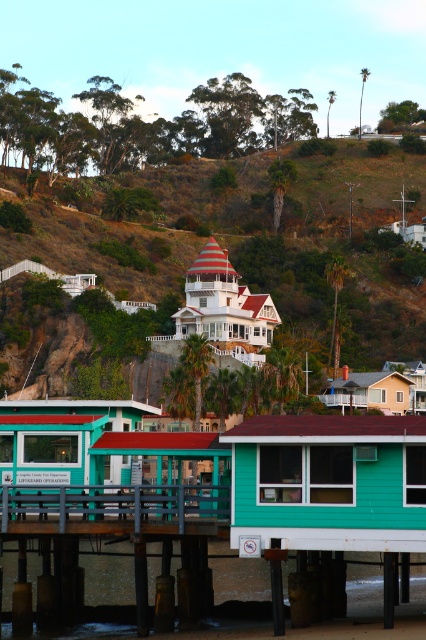
You are a tourist visiting the coastal area and want to take a photo of both the teal wood cabin at lower center and the teal wood cabin at center. Since you can only take one photo, where should you stand to ensure both cabins are visible in the frame?

You should stand to the left side of the teal wood cabin at center so that both the teal wood cabin at lower center and the teal wood cabin at center are visible in the frame, as the teal wood cabin at lower center is positioned on the right side of the teal wood cabin at center.

What is the spatial relationship between the teal wood cabin at center and the point labeled as point (66, 444)?

The teal wood cabin at center is represented by point (66, 444).